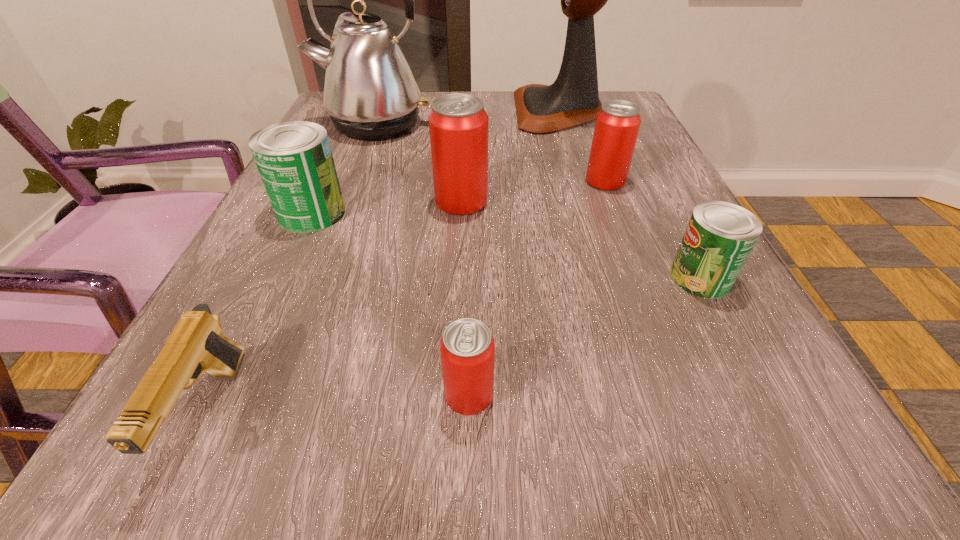
This screenshot has height=540, width=960. In order to click on object present at the far left corner in this screenshot , I will do `click(370, 92)`.

In order to click on object that is positioned at the near left corner in this screenshot , I will do `click(196, 345)`.

Image resolution: width=960 pixels, height=540 pixels. Identify the location of object situated at the far right corner. (573, 99).

Find the location of `vacant space at the far edge`. vacant space at the far edge is located at coordinates (420, 91).

The image size is (960, 540). I want to click on vacant space at the near edge of the desktop, so click(326, 446).

Identify the location of free space at the left edge of the desktop. This screenshot has width=960, height=540. (328, 240).

Find the location of a particular element. This screenshot has width=960, height=540. vacant space at the right edge of the desktop is located at coordinates (604, 224).

Identify the location of free space between the rightmost can and the second biggest red can. (653, 229).

Locate an element on the screen. The height and width of the screenshot is (540, 960). vacant space that's between the smallest red can and the biggest red can is located at coordinates (465, 298).

At what (x,y) coordinates should I click in order to perform the action: click on empty space between the tallest object and the second biggest red can. Please return your answer as a coordinate pair (x, y). This screenshot has width=960, height=540. Looking at the image, I should click on (582, 146).